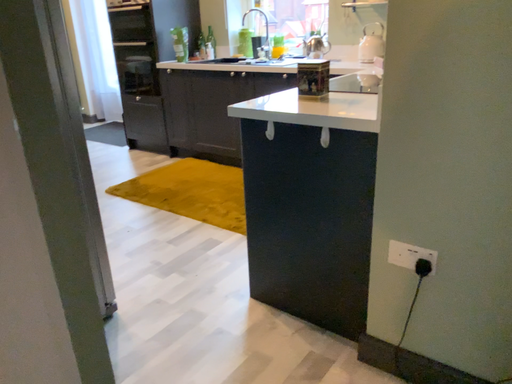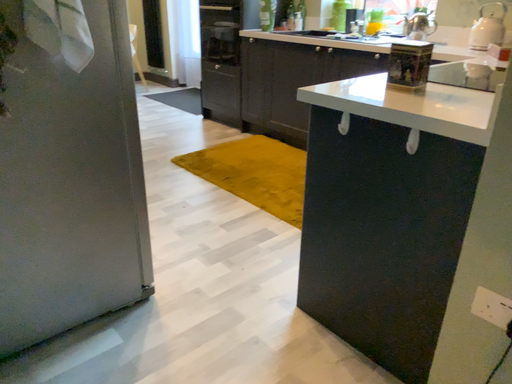
Question: Which way did the camera rotate in the video?

Choices:
 (A) rotated right
 (B) rotated left

Answer: (B)